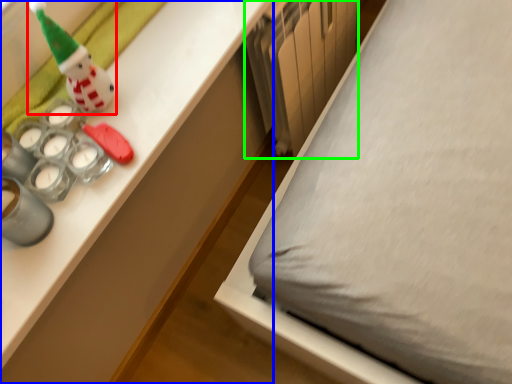
Question: Which is farther away from toy (highlighted by a red box)? desk (highlighted by a blue box) or radiator (highlighted by a green box)?

Choices:
 (A) desk
 (B) radiator

Answer: (B)